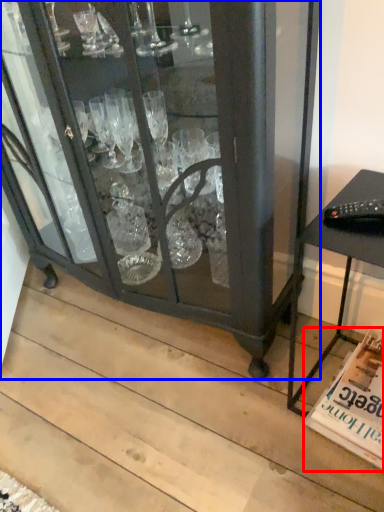
Question: Among these objects, which one is nearest to the camera, magazine (highlighted by a red box) or furniture (highlighted by a blue box)?

Choices:
 (A) magazine
 (B) furniture

Answer: (B)